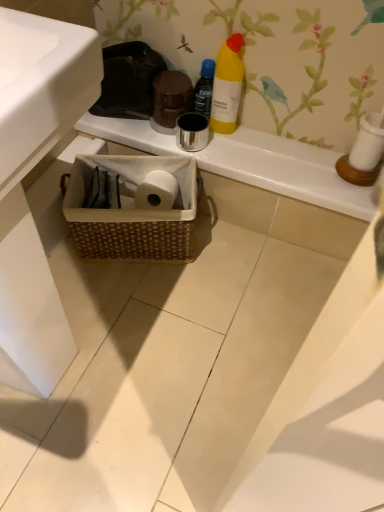
Question: Based on their positions, is woven basket at center located to the left or right of yellow matte bottle at upper center, the first bottle when ordered from left to right?

Choices:
 (A) left
 (B) right

Answer: (B)

Question: From the image's perspective, relative to yellow matte bottle at upper center, positioned as the second bottle in right-to-left order, is woven basket at center above or below?

Choices:
 (A) above
 (B) below

Answer: (B)

Question: Which object is positioned closest to the woven brown basket at lower center?

Choices:
 (A) white glossy sink at lower left
 (B) yellow matte bottle at upper center, the first bottle when ordered from left to right
 (C) yellow matte bottle at upper center, which is the 1th bottle in right-to-left order
 (D) woven basket at center

Answer: (D)

Question: Based on their relative distances, which object is farther from the white glossy sink at lower left?

Choices:
 (A) woven brown basket at lower center
 (B) woven basket at center
 (C) yellow matte bottle at upper center, positioned as the second bottle in right-to-left order
 (D) yellow matte bottle at upper center, which is the 1th bottle in right-to-left order

Answer: (C)